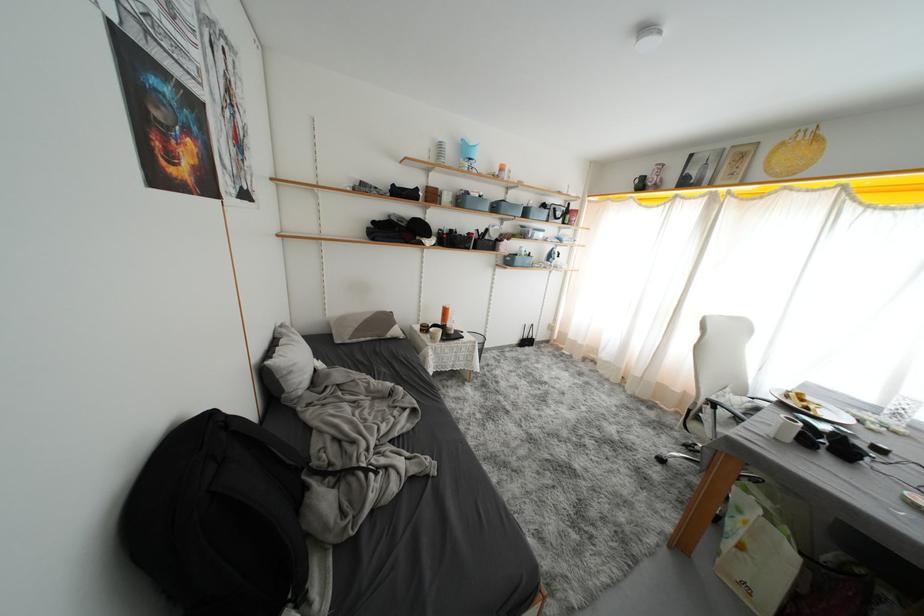
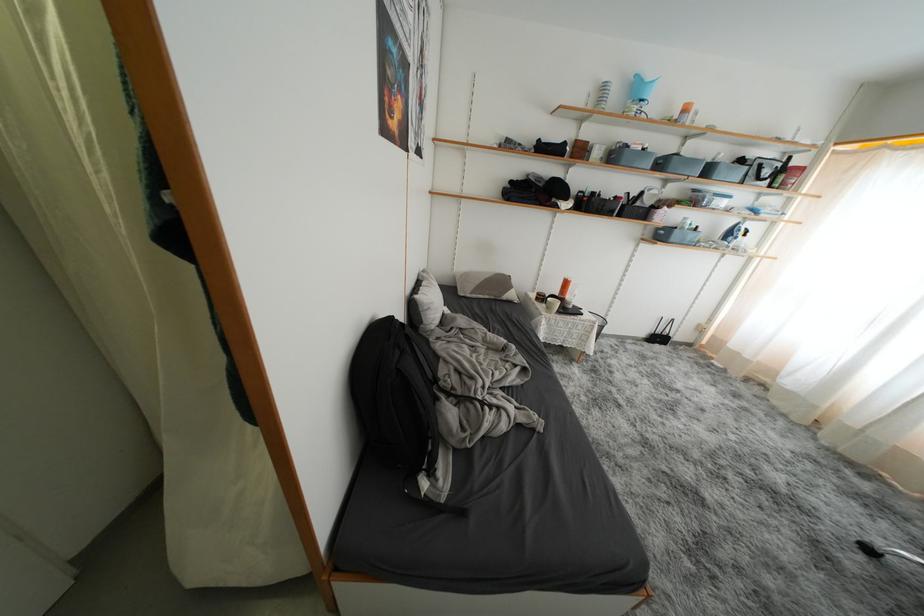
Find the pixel in the second image that matches point (452, 315) in the first image.

(572, 286)